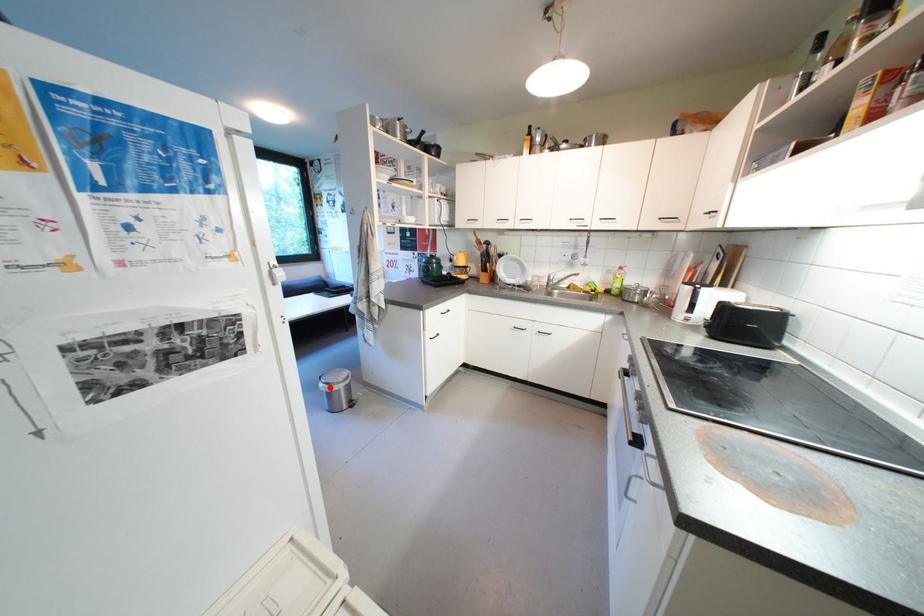
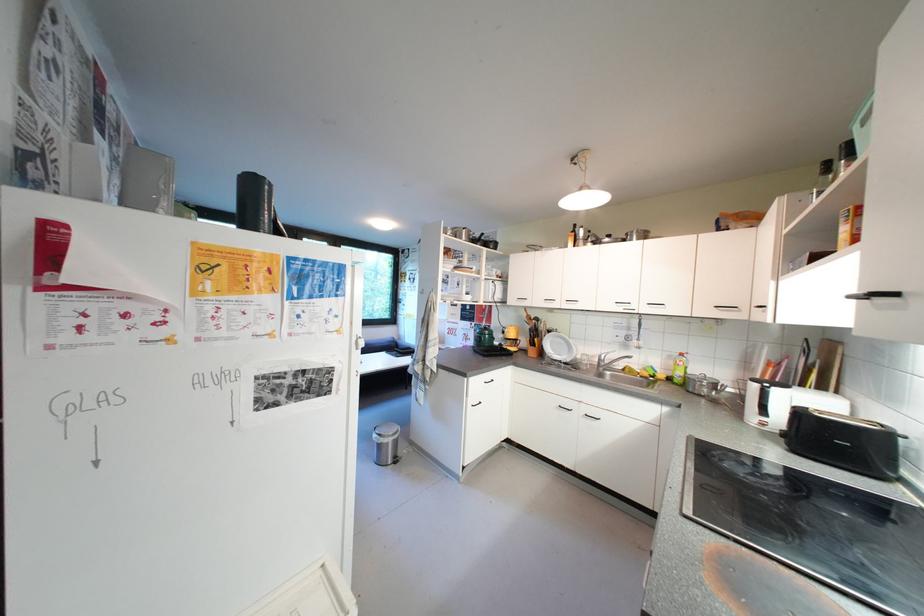
Where in the second image is the point corresponding to the highlighted location from the first image?

(383, 438)